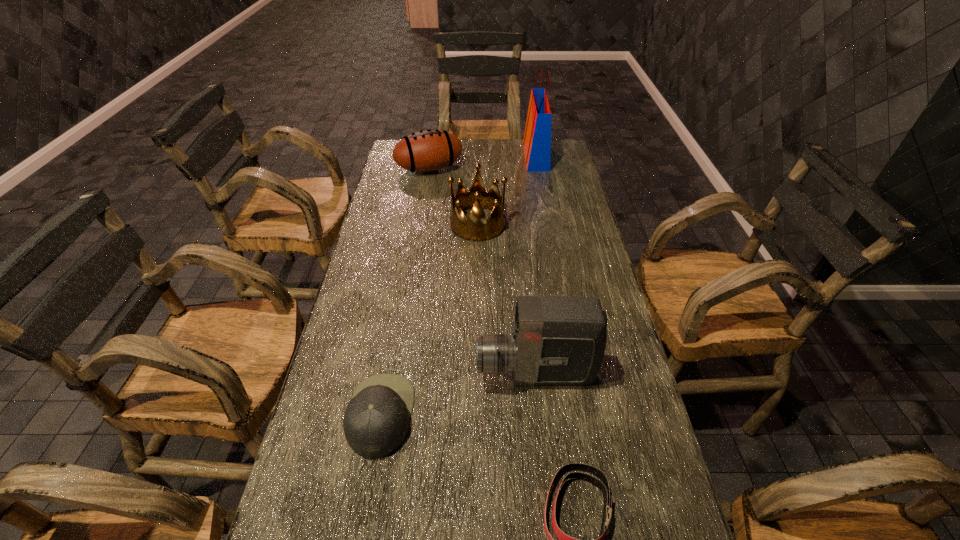
This screenshot has width=960, height=540. Identify the location of camcorder located at the right edge. (556, 340).

Image resolution: width=960 pixels, height=540 pixels. Find the location of `object at the far left corner`. object at the far left corner is located at coordinates (431, 150).

You are a GUI agent. You are given a task and a screenshot of the screen. Output one action in this format:
    pyautogui.click(x=<x>, y=<y>)
    Task: Click on the object present at the far right corner
    The height and width of the screenshot is (540, 960).
    Given the screenshot: What is the action you would take?
    (x=537, y=138)

The height and width of the screenshot is (540, 960). Find the location of `vacant space at the far edge of the desktop`. vacant space at the far edge of the desktop is located at coordinates (499, 161).

You are a GUI agent. You are given a task and a screenshot of the screen. Output one action in this format:
    pyautogui.click(x=<x>, y=<y>)
    Task: Click on the vacant position at the left edge of the desktop
    The height and width of the screenshot is (540, 960).
    Given the screenshot: What is the action you would take?
    click(x=385, y=258)

Locate an element on the screen. vacant space at the right edge is located at coordinates (587, 236).

Identify the location of unoccupied position between the third tallest object and the shopping bag. (507, 190).

At what (x,y) coordinates should I click in order to perform the action: click on free space between the cap and the camcorder. Please return your answer as a coordinate pair (x, y). Looking at the image, I should click on (458, 395).

Identify the location of unoccupied area between the camcorder and the fourth tallest object. The width and height of the screenshot is (960, 540). (482, 272).

Image resolution: width=960 pixels, height=540 pixels. Find the location of `empty space that is in between the shopping bag and the football (American)`. empty space that is in between the shopping bag and the football (American) is located at coordinates (483, 163).